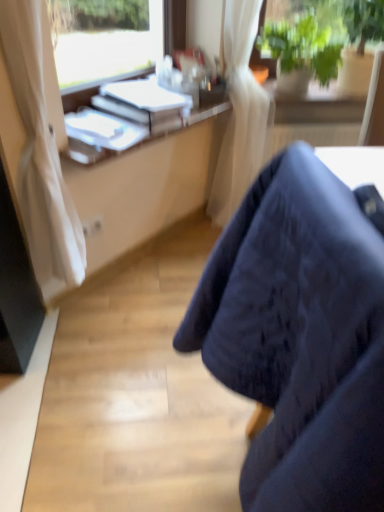
This screenshot has height=512, width=384. Find the location of `vacant space in white plastic desk at upper left (from a real-world perspective)`. vacant space in white plastic desk at upper left (from a real-world perspective) is located at coordinates (172, 243).